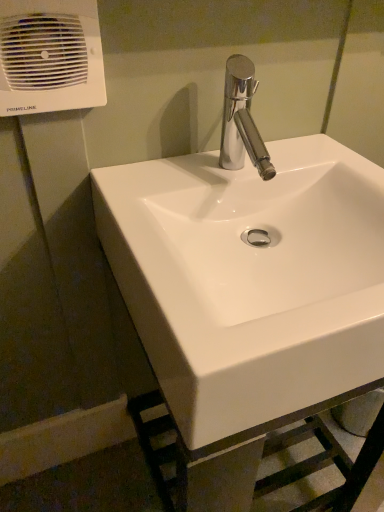
Question: Is the depth of white plastic air conditioning unit at upper left less than that of white glossy sink at center?

Choices:
 (A) yes
 (B) no

Answer: (B)

Question: Does white plastic air conditioning unit at upper left appear on the right side of white glossy sink at center?

Choices:
 (A) yes
 (B) no

Answer: (B)

Question: From the image's perspective, is white plastic air conditioning unit at upper left under white glossy sink at center?

Choices:
 (A) yes
 (B) no

Answer: (B)

Question: From a real-world perspective, is white plastic air conditioning unit at upper left physically below white glossy sink at center?

Choices:
 (A) no
 (B) yes

Answer: (A)

Question: Does white plastic air conditioning unit at upper left have a greater height compared to white glossy sink at center?

Choices:
 (A) no
 (B) yes

Answer: (A)

Question: Considering the relative sizes of white plastic air conditioning unit at upper left and white glossy sink at center in the image provided, is white plastic air conditioning unit at upper left bigger than white glossy sink at center?

Choices:
 (A) yes
 (B) no

Answer: (B)

Question: From a real-world perspective, is white glossy sink at center below white plastic air conditioning unit at upper left?

Choices:
 (A) yes
 (B) no

Answer: (A)

Question: Is white glossy sink at center to the left of white plastic air conditioning unit at upper left from the viewer's perspective?

Choices:
 (A) yes
 (B) no

Answer: (B)

Question: Can you confirm if white glossy sink at center is positioned to the right of white plastic air conditioning unit at upper left?

Choices:
 (A) no
 (B) yes

Answer: (B)

Question: Is white glossy sink at center positioned in front of white plastic air conditioning unit at upper left?

Choices:
 (A) yes
 (B) no

Answer: (A)

Question: From a real-world perspective, is white glossy sink at center on top of white plastic air conditioning unit at upper left?

Choices:
 (A) no
 (B) yes

Answer: (A)

Question: Is there a large distance between white glossy sink at center and white plastic air conditioning unit at upper left?

Choices:
 (A) no
 (B) yes

Answer: (A)

Question: Considering the positions of white glossy sink at center and white plastic air conditioning unit at upper left in the image, is white glossy sink at center wider or thinner than white plastic air conditioning unit at upper left?

Choices:
 (A) thin
 (B) wide

Answer: (B)